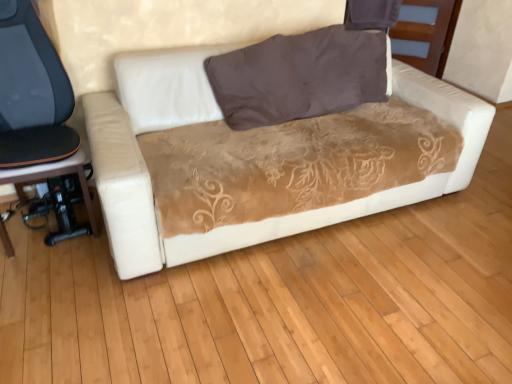
Identify the location of free space below black leather chair at left (from a real-world perspective). Image resolution: width=512 pixels, height=384 pixels. (35, 224).